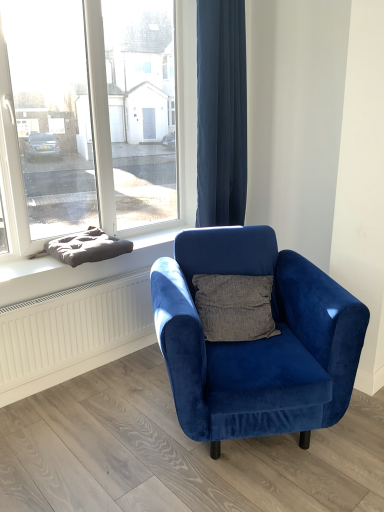
Question: Based on their sizes in the image, would you say dark gray cushion at left is bigger or smaller than velvet blue armchair at center?

Choices:
 (A) small
 (B) big

Answer: (A)

Question: Is dark gray cushion at left wider or thinner than velvet blue armchair at center?

Choices:
 (A) thin
 (B) wide

Answer: (A)

Question: Which of these objects is positioned farthest from the transparent glass window at upper left?

Choices:
 (A) white textured radiator at lower left
 (B) velvet blue armchair at center
 (C) dark gray cushion at left
 (D) dark blue fabric curtain at upper right

Answer: (B)

Question: Estimate the real-world distances between objects in this image. Which object is closer to the dark blue fabric curtain at upper right?

Choices:
 (A) velvet blue armchair at center
 (B) dark gray cushion at left
 (C) transparent glass window at upper left
 (D) white textured radiator at lower left

Answer: (C)